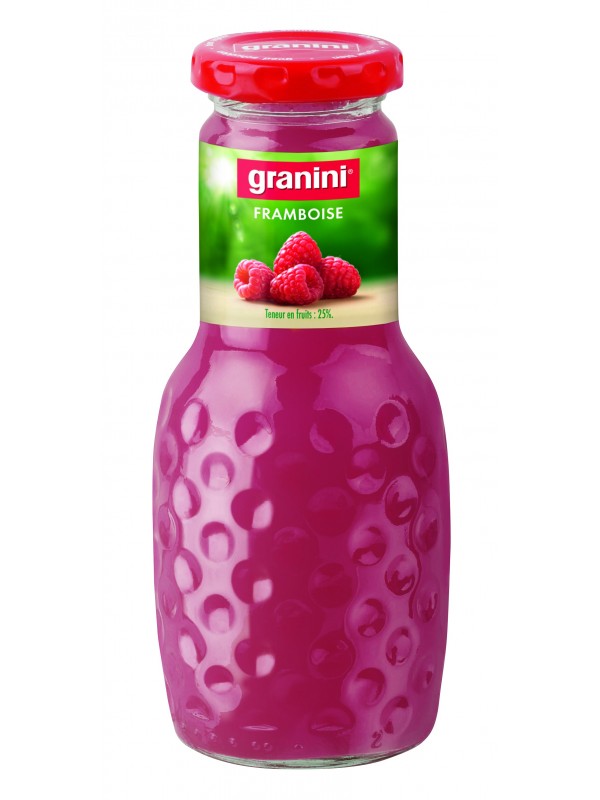
This screenshot has height=800, width=600. What are the coordinates of `jar` in the screenshot? It's located at (284, 522).